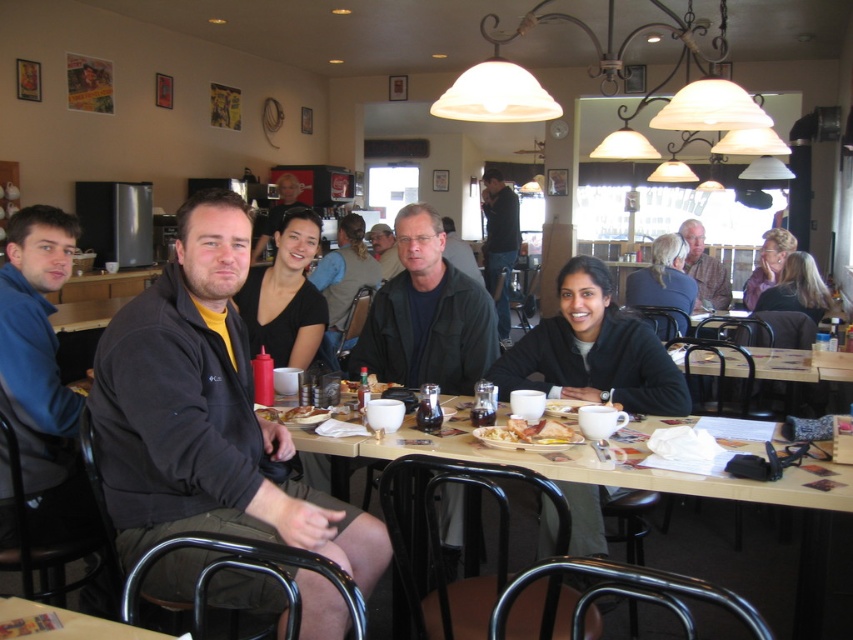
You are a customer in this diner and you want to hang your coat on the back of the chair. The chair you are sitting on has a height limit of 1.2 meters for hanging items. Which jacket, the light brown leather jacket at upper right or the matte black jacket at center, would you choose to hang without exceeding the height limit?

The matte black jacket at center is shorter than the light brown leather jacket at upper right. Since the chair has a height limit of 1.2 meters, you should choose the matte black jacket at center to hang without exceeding the limit.

You are a server at the diner and need to place a large platter of food on the table. The platter is as wide as the dark gray fleece jacket at center. Will it fit on the wooden table at center?

The dark gray fleece jacket at center is narrower than the wooden table at center, so the platter, which is as wide as the jacket, will fit on the table.

You are a server at the diner and need to place a large dessert plate on the table. Given that the matte black jacket at center is currently occupying space on the wooden table at center, can you still fit the dessert plate there?

The wooden table at center has a larger size compared to matte black jacket at center, so there should be enough space to place the dessert plate even with the jacket taking up some area.